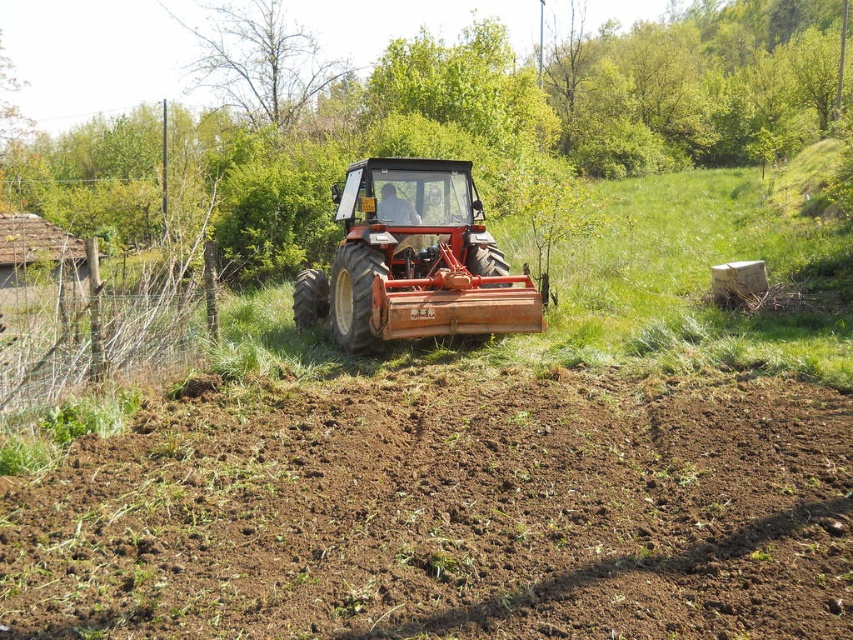
Question: Which point appears closest to the camera in this image?

Choices:
 (A) (396, 310)
 (B) (648, 445)

Answer: (B)

Question: Can you confirm if brown soil at center is bigger than orange metal plow at center?

Choices:
 (A) no
 (B) yes

Answer: (A)

Question: Which object is farther from the camera taking this photo?

Choices:
 (A) orange metal plow at center
 (B) brown soil at center

Answer: (A)

Question: Which point is closer to the camera?

Choices:
 (A) (321, 300)
 (B) (633, 516)

Answer: (B)

Question: Is brown soil at center closer to the viewer compared to orange metal plow at center?

Choices:
 (A) no
 (B) yes

Answer: (B)

Question: Is brown soil at center wider than orange metal plow at center?

Choices:
 (A) no
 (B) yes

Answer: (B)